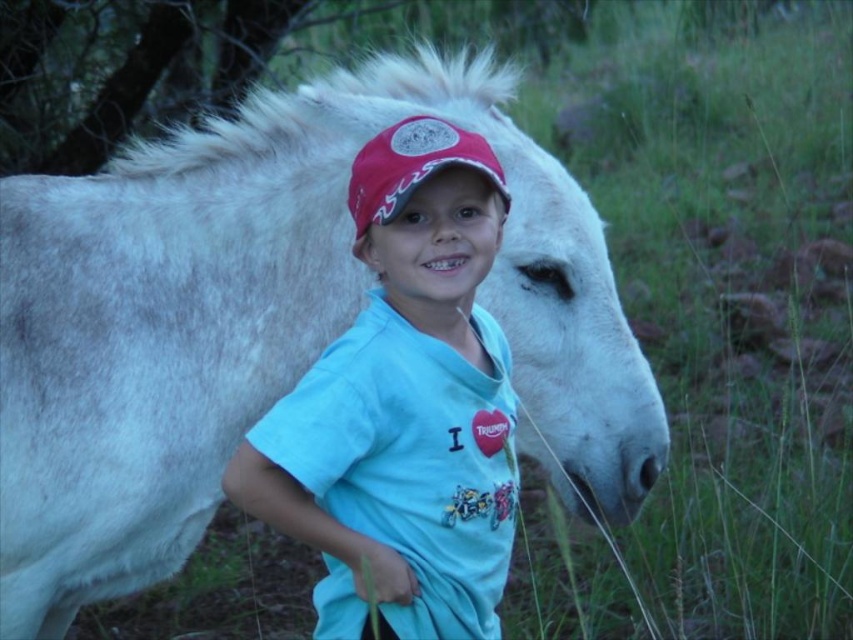
You are a photographer trying to position a drone to capture the white matte horse at center. The drone must be placed at coordinates that are exactly 0.2 units to the right and 0.1 units above the horse. What are the new coordinates for the drone?

The white matte horse at center is located at coordinates (263,323). Adding 0.2 to the x coordinate gives 0.706 and adding 0.1 to the y coordinate gives 0.409. Therefore, the drone should be positioned at coordinates (347,451).

You are a photographer trying to capture a clear shot of the matte red cap at center and the white matte horse at center. Since you want to focus on the cap, which object should you adjust your camera to be closer to?

You should adjust your camera to be closer to the matte red cap at center because it is closer to the viewer than the white matte horse at center, allowing for better focus on the cap.

Based on the photo, you are a photographer setting up a tripod to take a portrait of the white matte horse at center and the matte red cap at center. Since the horse is much bigger, you want to ensure both subjects are framed properly. Which subject should you focus on first to make sure they are in the frame?

The white matte horse at center is larger in size than the matte red cap at center, so you should focus on the white matte horse at center first to ensure it fits within the frame before adjusting for the smaller matte red cap at center.